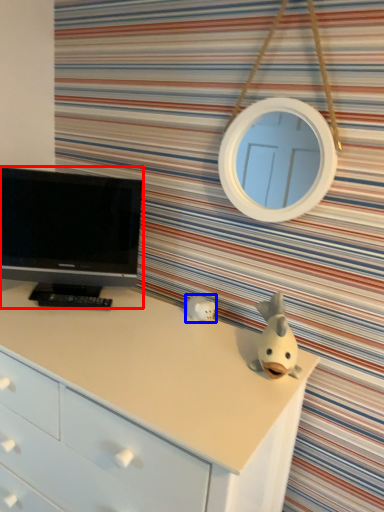
Question: Which object appears closest to the camera in this image, television (highlighted by a red box) or toy (highlighted by a blue box)?

Choices:
 (A) television
 (B) toy

Answer: (A)